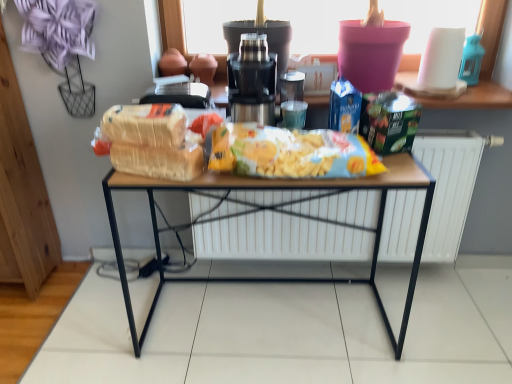
Question: Is metallic silver coffee machine at center far from bread at center?

Choices:
 (A) yes
 (B) no

Answer: (B)

Question: Is metallic silver coffee machine at center bigger than bread at center?

Choices:
 (A) no
 (B) yes

Answer: (B)

Question: Is metallic silver coffee machine at center positioned behind bread at center?

Choices:
 (A) yes
 (B) no

Answer: (A)

Question: Considering the relative sizes of metallic silver coffee machine at center and bread at center in the image provided, is metallic silver coffee machine at center taller than bread at center?

Choices:
 (A) yes
 (B) no

Answer: (A)

Question: Is metallic silver coffee machine at center facing away from bread at center?

Choices:
 (A) no
 (B) yes

Answer: (A)

Question: Is translucent plastic bag of cereal at center wider or thinner than white matte radiator at center?

Choices:
 (A) wide
 (B) thin

Answer: (A)

Question: Based on their positions, is translucent plastic bag of cereal at center located to the left or right of white matte radiator at center?

Choices:
 (A) right
 (B) left

Answer: (B)

Question: Is translucent plastic bag of cereal at center in front of or behind white matte radiator at center in the image?

Choices:
 (A) front
 (B) behind

Answer: (A)

Question: Is translucent plastic bag of cereal at center taller or shorter than white matte radiator at center?

Choices:
 (A) tall
 (B) short

Answer: (B)

Question: Looking at the image, does yellow matte chips at center seem bigger or smaller compared to white matte radiator at center?

Choices:
 (A) big
 (B) small

Answer: (B)

Question: Is yellow matte chips at center spatially inside white matte radiator at center, or outside of it?

Choices:
 (A) outside
 (B) inside

Answer: (A)

Question: From the image's perspective, is yellow matte chips at center positioned above or below white matte radiator at center?

Choices:
 (A) above
 (B) below

Answer: (A)

Question: From a real-world perspective, is yellow matte chips at center physically located above or below white matte radiator at center?

Choices:
 (A) below
 (B) above

Answer: (B)

Question: Is point (254, 91) closer or farther from the camera than point (394, 183)?

Choices:
 (A) closer
 (B) farther

Answer: (B)

Question: Is metallic silver coffee machine at center to the left or to the right of wooden table at center in the image?

Choices:
 (A) right
 (B) left

Answer: (B)